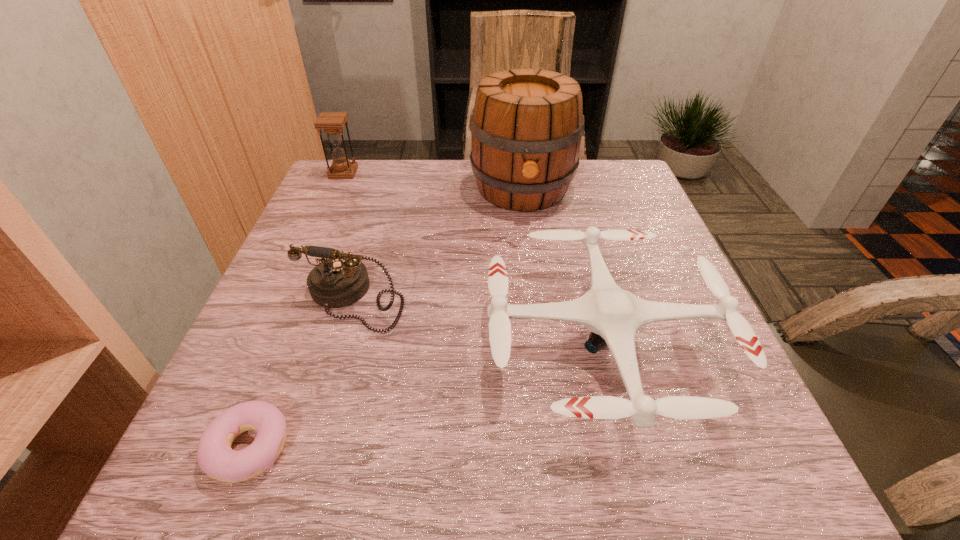
In order to click on vacant area between the cider and the telephone in this screenshot , I will do `click(438, 244)`.

Find the location of a particular element. This screenshot has width=960, height=540. vacant area between the doughnut and the second tallest object is located at coordinates (297, 310).

Find the location of a particular element. The width and height of the screenshot is (960, 540). vacant area that lies between the doughnut and the tallest object is located at coordinates (386, 319).

Where is `free space between the drone and the cider`? free space between the drone and the cider is located at coordinates (563, 265).

Where is `free space between the hourglass and the drone`? The image size is (960, 540). free space between the hourglass and the drone is located at coordinates (473, 257).

Locate an element on the screen. This screenshot has height=540, width=960. free space between the drone and the hourglass is located at coordinates (473, 257).

Where is `the fourth closest object to the second tallest object`? The height and width of the screenshot is (540, 960). the fourth closest object to the second tallest object is located at coordinates (215, 457).

You are a GUI agent. You are given a task and a screenshot of the screen. Output one action in this format:
    pyautogui.click(x=<x>, y=<y>)
    Task: Click on the object that stands as the closest to the drone
    
    Given the screenshot: What is the action you would take?
    pyautogui.click(x=526, y=127)